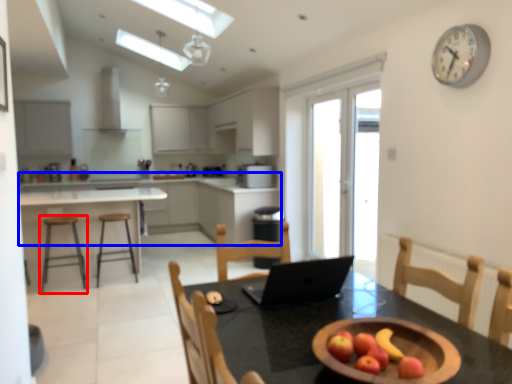
Question: Among these objects, which one is farthest to the camera, stool (highlighted by a red box) or cabinetry (highlighted by a blue box)?

Choices:
 (A) stool
 (B) cabinetry

Answer: (B)